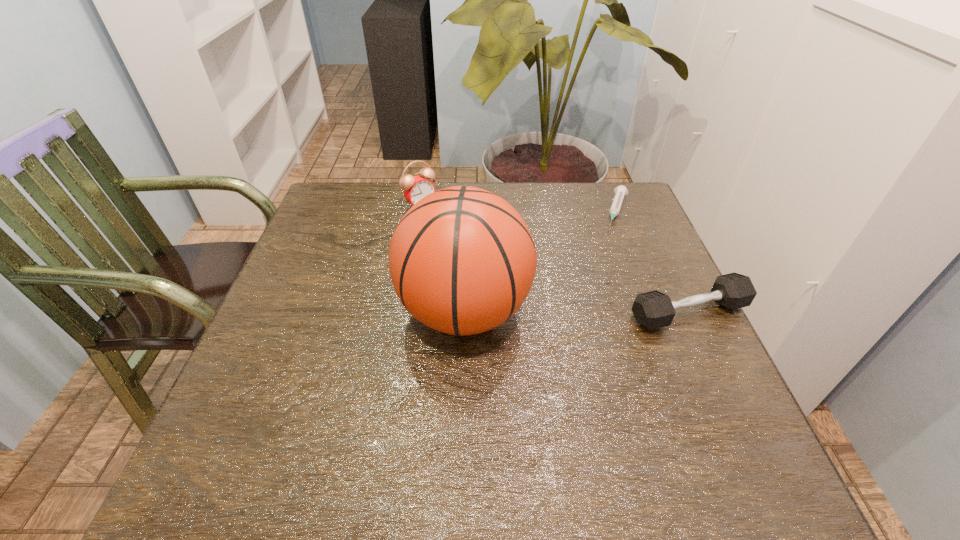
At what (x,y) coordinates should I click in order to perform the action: click on basketball. Please return your answer as a coordinate pair (x, y). The height and width of the screenshot is (540, 960). Looking at the image, I should click on (462, 260).

Where is `the third tallest object`? This screenshot has height=540, width=960. the third tallest object is located at coordinates (654, 309).

You are a GUI agent. You are given a task and a screenshot of the screen. Output one action in this format:
    pyautogui.click(x=<x>, y=<y>)
    Task: Click on the shortest object
    The height and width of the screenshot is (540, 960).
    Given the screenshot: What is the action you would take?
    pyautogui.click(x=620, y=191)

Identify the location of alarm clock. This screenshot has height=540, width=960. (415, 188).

Where is `blank area located on the back of the tallest object`? blank area located on the back of the tallest object is located at coordinates (468, 197).

Find the location of a particular element. vacant position located on the left of the second shortest object is located at coordinates (443, 312).

Find the location of a particular element. This screenshot has height=540, width=960. free space located 0.210m at the needle end of the syringe is located at coordinates (603, 279).

Where is `vacant region located at the needle end of the syringe`? The image size is (960, 540). vacant region located at the needle end of the syringe is located at coordinates (605, 274).

Where is `vacant region located 0.310m at the needle end of the syringe`? This screenshot has width=960, height=540. vacant region located 0.310m at the needle end of the syringe is located at coordinates (594, 308).

Find the location of a particular element. vacant space situated 0.180m on the clock face of the alarm clock is located at coordinates (467, 243).